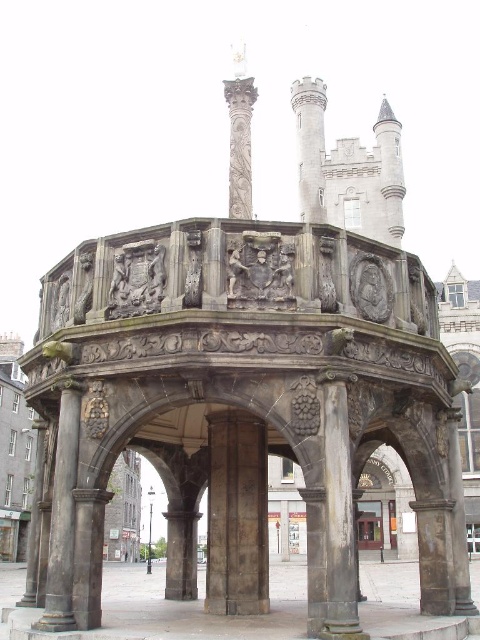
Question: Is dark gray stone column at center above glass door at center?

Choices:
 (A) yes
 (B) no

Answer: (A)

Question: Which point appears closest to the camera in this image?

Choices:
 (A) (367, 500)
 (B) (227, 426)
 (C) (57, 458)

Answer: (C)

Question: Is dark gray stone column at center thinner than glass door at center?

Choices:
 (A) no
 (B) yes

Answer: (B)

Question: Is bronze stone column at center bigger than glass door at center?

Choices:
 (A) no
 (B) yes

Answer: (A)

Question: Estimate the real-world distances between objects in this image. Which object is closer to the dark gray stone column at center?

Choices:
 (A) glass door at center
 (B) bronze stone column at center

Answer: (B)

Question: Considering the real-world distances, which object is closest to the bronze stone column at center?

Choices:
 (A) dark gray stone column at center
 (B) glass door at center

Answer: (A)